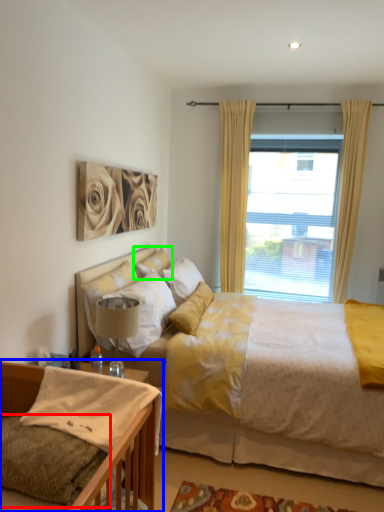
Question: Which object is the closest to the pillow (highlighted by a red box)? Choose among these: bed (highlighted by a blue box) or pillow (highlighted by a green box).

Choices:
 (A) bed
 (B) pillow

Answer: (A)